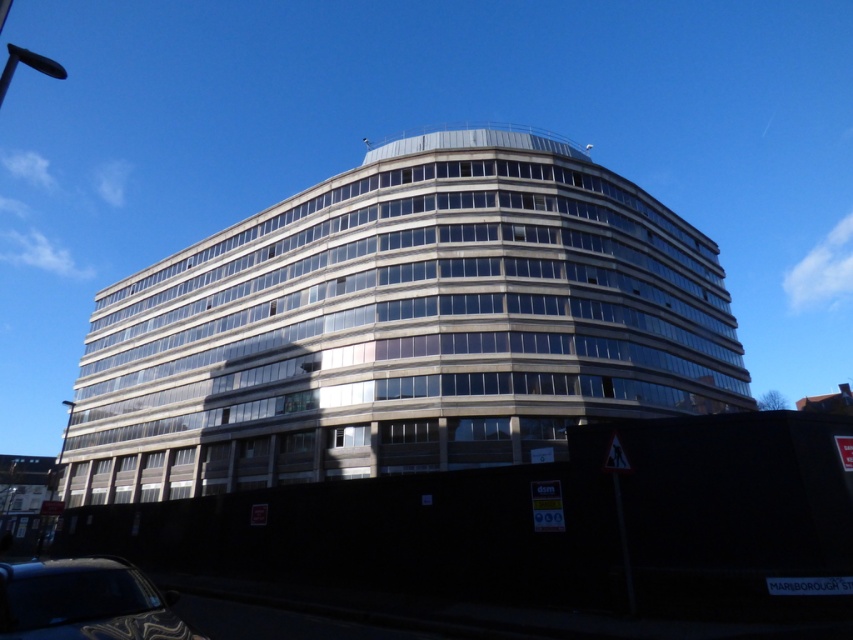
Question: Can you confirm if white concrete building at center is bigger than shiny black car at lower left?

Choices:
 (A) no
 (B) yes

Answer: (B)

Question: In this image, where is white concrete building at center located relative to shiny black car at lower left?

Choices:
 (A) above
 (B) below

Answer: (B)

Question: Is white concrete building at center closer to the viewer compared to shiny black car at lower left?

Choices:
 (A) yes
 (B) no

Answer: (B)

Question: Among these objects, which one is farthest from the camera?

Choices:
 (A) white concrete building at center
 (B) shiny black car at lower left

Answer: (A)

Question: Which point is closer to the camera?

Choices:
 (A) shiny black car at lower left
 (B) white concrete building at center

Answer: (A)